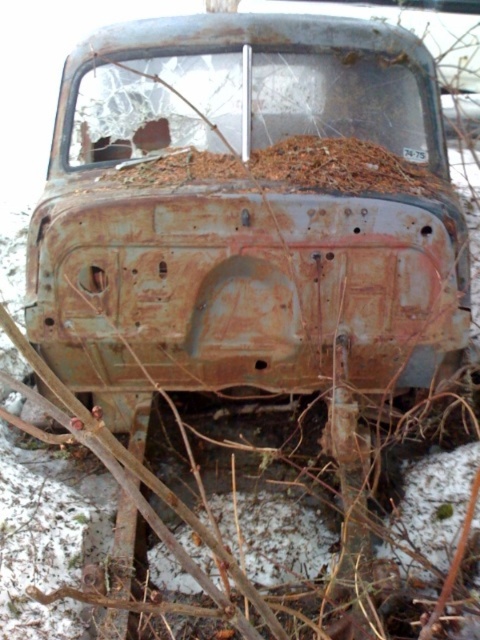
From the picture: You are a photographer standing near the rusty metal car at center. You want to take a photo of it from a distance of 2 meters. Can you move closer to the car to achieve this? Explain your reasoning.

The distance between you and the rusty metal car at center is 1.98 meters, which is already closer than the desired 2 meters. To take the photo from exactly 2 meters away, you need to move slightly away from the car.

You are standing in front of the rusty metal car at center and want to touch the rusty metal hood at center. Can you reach it without moving your feet?

The rusty metal car at center is closer to the viewer than the rusty metal hood at center, so you can reach it without moving your feet.

You are a surveyor trying to locate the rusty metal car at center. According to the coordinates provided, where would you find it in the image?

The rusty metal car at center is located at coordinates point (248, 214).